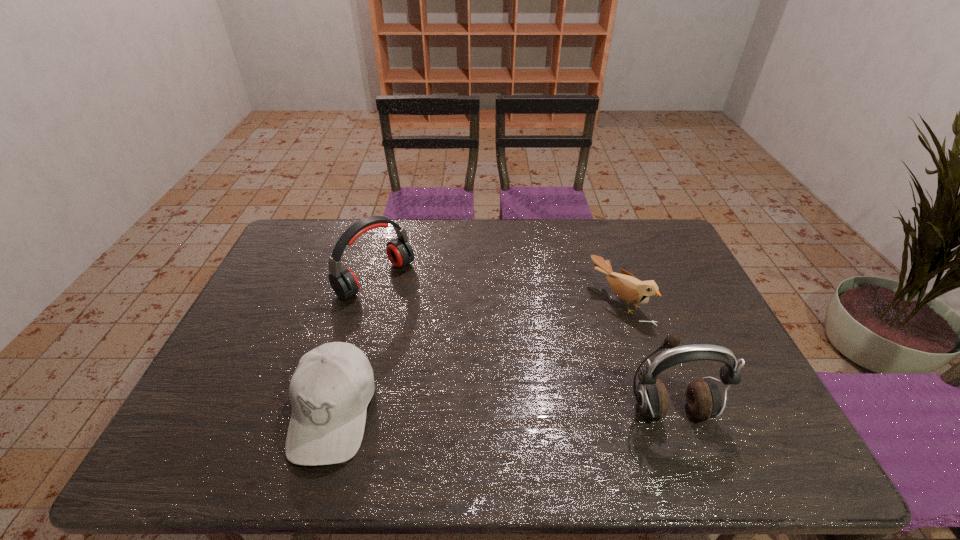
The height and width of the screenshot is (540, 960). Identify the location of free space on the desktop that is between the baseball cap and the taller earphone and is positioned at the beak of the bird. (458, 411).

I want to click on free spot on the desktop that is between the baseball cap and the tallest object and is positioned on the ear cups of the second tallest object, so click(544, 411).